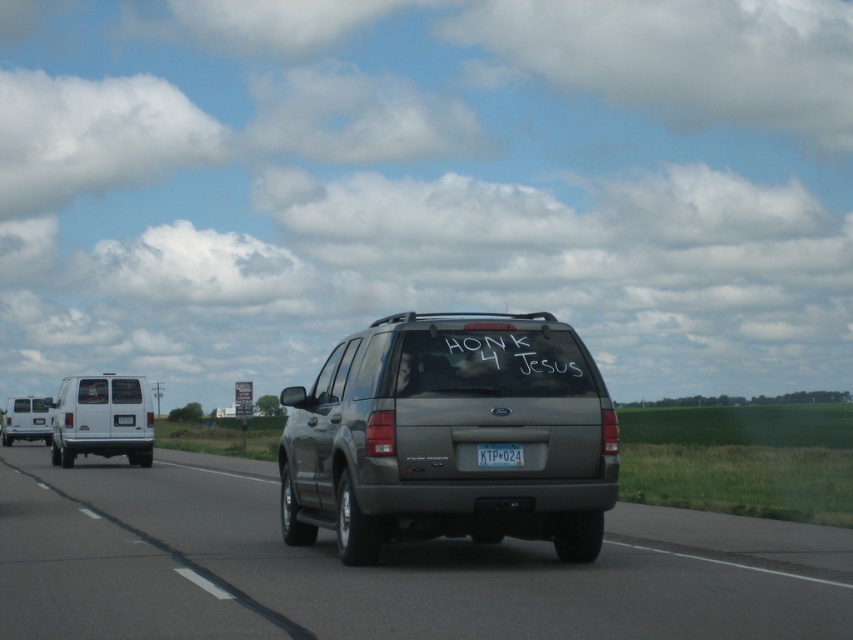
Who is more distant from viewer, [424,326] or [114,419]?

The point [114,419] is behind.

Can you confirm if matte gray suv at center is positioned below white matte van at left?

Incorrect, matte gray suv at center is not positioned below white matte van at left.

The image size is (853, 640). What are the coordinates of `matte gray suv at center` in the screenshot? It's located at (450, 436).

Can you confirm if matte gray suv at center is positioned below white plastic license plate at center?

Indeed, matte gray suv at center is positioned under white plastic license plate at center.

Measure the distance between matte gray suv at center and white plastic license plate at center.

They are 15.22 inches apart.

Is point (512, 380) more distant than point (480, 452)?

That is True.

The image size is (853, 640). In order to click on matte gray suv at center in this screenshot , I will do `click(450, 436)`.

Between point (712, 579) and point (97, 397), which one is positioned in front?

Point (712, 579) is more forward.

Who is shorter, satin gray suv at center or white matte van at left?

satin gray suv at center

Is point (846, 604) farther from camera compared to point (125, 397)?

No, (846, 604) is in front of (125, 397).

What are the coordinates of `satin gray suv at center` in the screenshot? It's located at (375, 570).